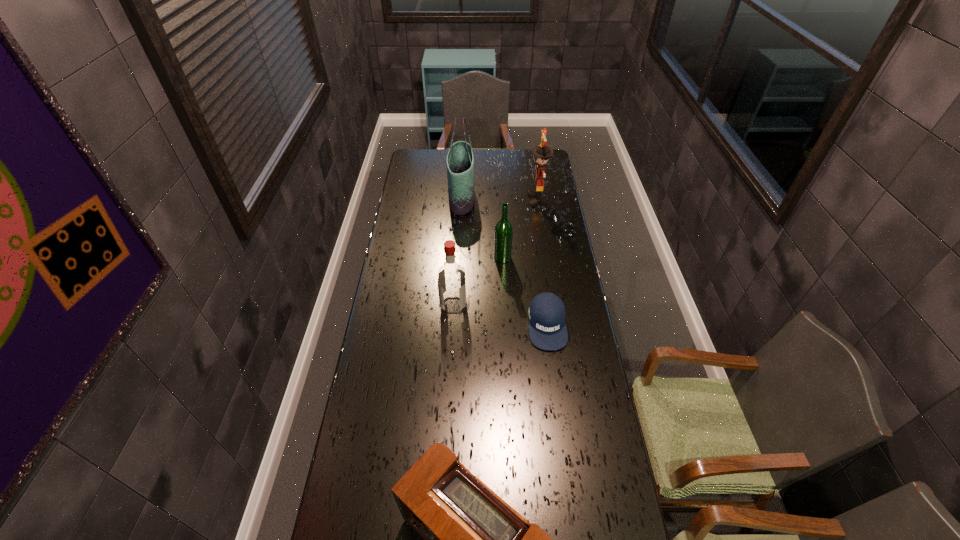
Where is `blank space located on the front of the third farthest object`? blank space located on the front of the third farthest object is located at coordinates (506, 329).

Identify the location of free space located on the front-facing side of the shortest object. Image resolution: width=960 pixels, height=540 pixels. (559, 413).

The height and width of the screenshot is (540, 960). I want to click on nutcracker that is at the right edge, so click(542, 152).

Where is `baseball cap that is at the right edge`? This screenshot has width=960, height=540. baseball cap that is at the right edge is located at coordinates (547, 330).

In the image, there is a desktop. Where is `vacant space at the far edge`? The height and width of the screenshot is (540, 960). vacant space at the far edge is located at coordinates (506, 164).

This screenshot has height=540, width=960. In order to click on vacant area at the left edge of the desktop in this screenshot , I will do `click(418, 241)`.

I want to click on vacant space at the right edge of the desktop, so click(571, 265).

This screenshot has height=540, width=960. What are the coordinates of `vacant area that lies between the liquor and the tote bag` in the screenshot? It's located at (458, 252).

Find the location of a particular element. Image resolution: width=960 pixels, height=540 pixels. free spot between the alcohol and the shortest object is located at coordinates (525, 291).

Locate an element on the screen. free space that is in between the nutcracker and the tote bag is located at coordinates (499, 199).